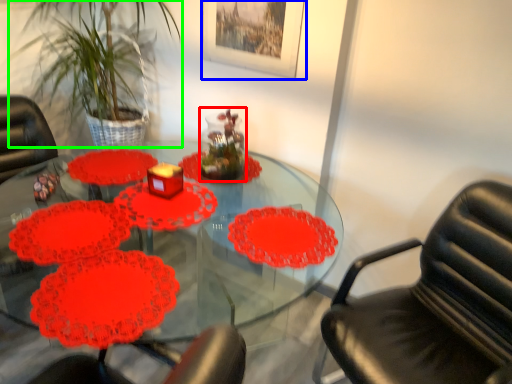
Question: Which object is the farthest from glass vase (highlighted by a red box)? Choose among these: picture frame (highlighted by a blue box) or plant (highlighted by a green box).

Choices:
 (A) picture frame
 (B) plant

Answer: (B)